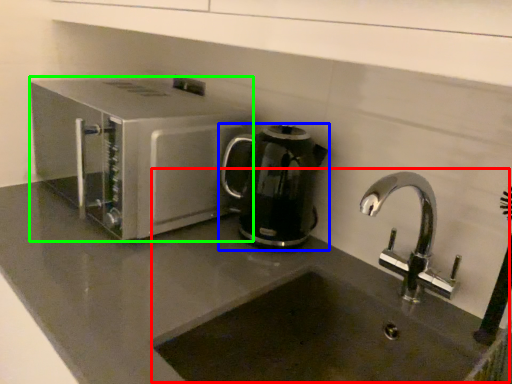
Question: Based on their relative distances, which object is nearer to sink (highlighted by a red box)? Choose from kitchen appliance (highlighted by a blue box) and home appliance (highlighted by a green box).

Choices:
 (A) kitchen appliance
 (B) home appliance

Answer: (A)